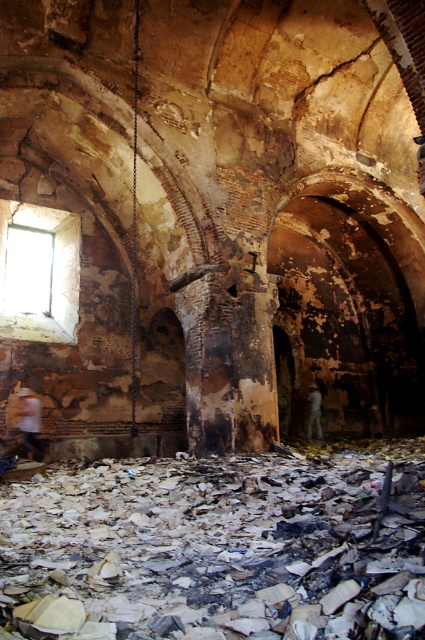
You are a historian examining the interior of a dilapidated historical building. You notice the burnt paper at center. Based on the coordinates provided, can you determine its exact location within the room?

The burnt paper at center is located at coordinates point (223, 545).

You are an inspector assessing the structural integrity of the building. You notice the rusty metal archway at center and the transparent glass window at upper left. Which of these two features has a greater width?

The rusty metal archway at center has a greater width than the transparent glass window at upper left.

You are a preservationist standing in the center of the room. You need to reach the transparent glass window at upper left to assess its condition. Given that the distance between you and the window is 13.62 meters, can you safely walk to it without needing to cross any debris? The debris is scattered across the floor but not in a straight path from your current position to the window.

The distance between you and the transparent glass window at upper left is 13.62 meters. Since the debris is scattered but not in a straight path, you can safely walk to the window without needing to cross any debris.